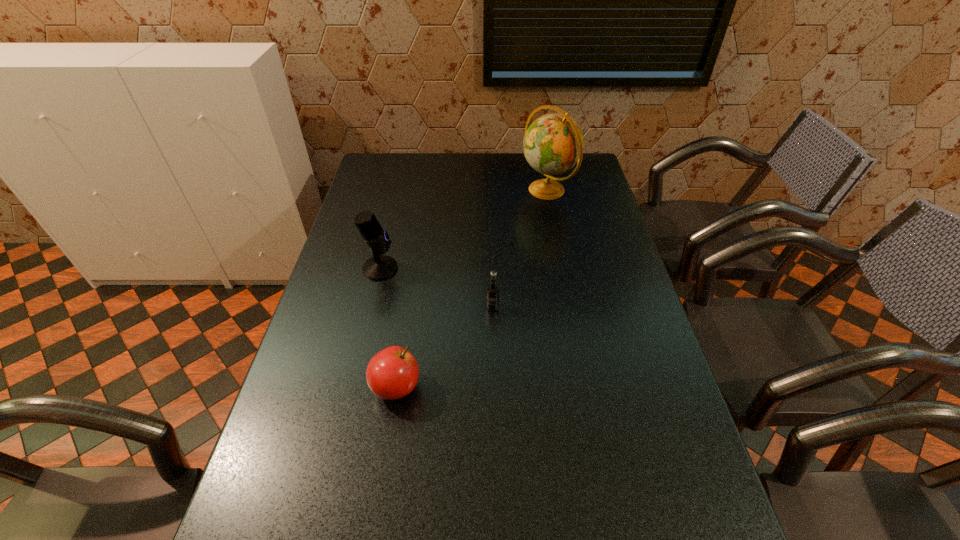
In order to click on the tallest object in this screenshot , I will do `click(553, 144)`.

You are a GUI agent. You are given a task and a screenshot of the screen. Output one action in this format:
    pyautogui.click(x=<x>, y=<y>)
    Task: Click on the globe
    The height and width of the screenshot is (540, 960).
    Given the screenshot: What is the action you would take?
    pyautogui.click(x=553, y=144)

Find the location of a particular element. This screenshot has height=540, width=960. the third shortest object is located at coordinates (380, 267).

In order to click on microphone in this screenshot , I will do `click(380, 267)`.

Find the location of `the second object from right to left`. the second object from right to left is located at coordinates (492, 305).

The image size is (960, 540). I want to click on root beer, so click(492, 305).

Locate an element on the screen. the nearest object is located at coordinates (392, 373).

Where is `the shortest object`? Image resolution: width=960 pixels, height=540 pixels. the shortest object is located at coordinates (392, 373).

Where is `vacant area located 0.160m on the left of the globe`? vacant area located 0.160m on the left of the globe is located at coordinates (478, 190).

At what (x,y) coordinates should I click in order to perform the action: click on free space located 0.300m on the stand of the second farthest object. Please return your answer as a coordinate pair (x, y). The image size is (960, 540). Looking at the image, I should click on (494, 268).